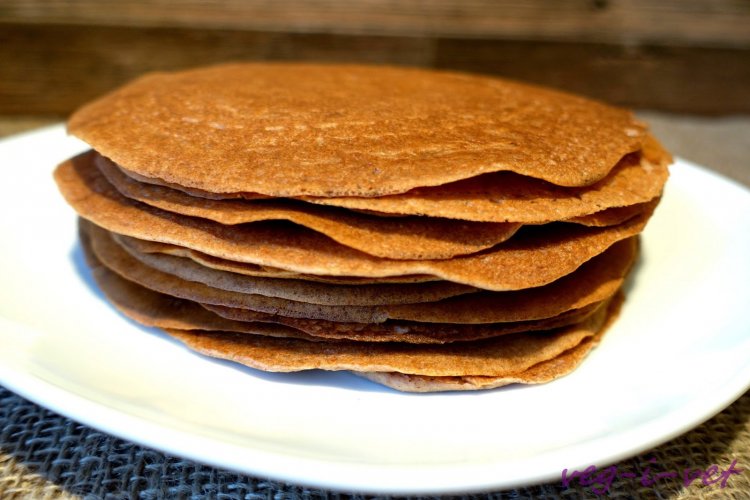
This screenshot has width=750, height=500. I want to click on lightwood, so click(654, 18).